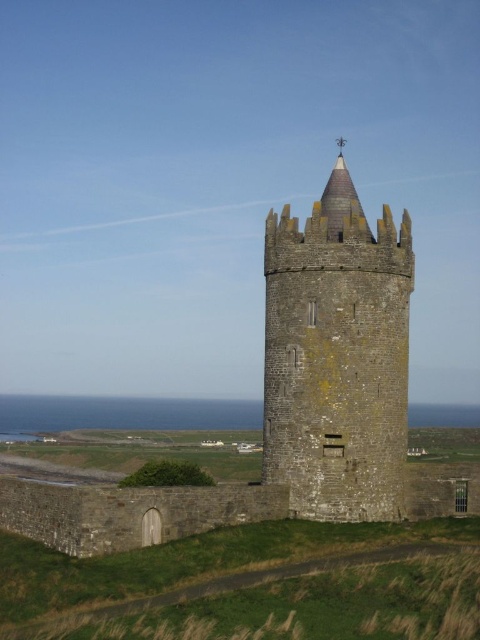
Can you confirm if stone tower at center is positioned above dark brown stone tower at center?

Incorrect, stone tower at center is not positioned above dark brown stone tower at center.

Identify the location of stone tower at center. (290, 403).

The width and height of the screenshot is (480, 640). What are the coordinates of `stone tower at center` in the screenshot? It's located at (290, 403).